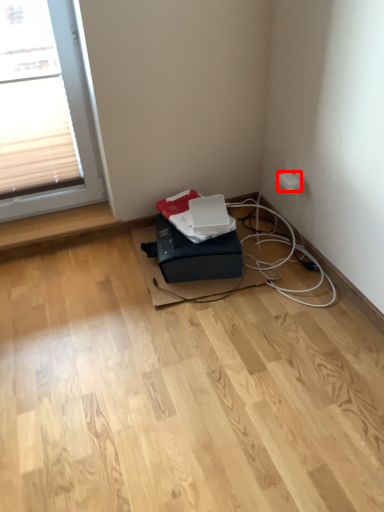
Question: From the image's perspective, where is electric outlet (annotated by the red box) located relative to box?

Choices:
 (A) below
 (B) above

Answer: (B)